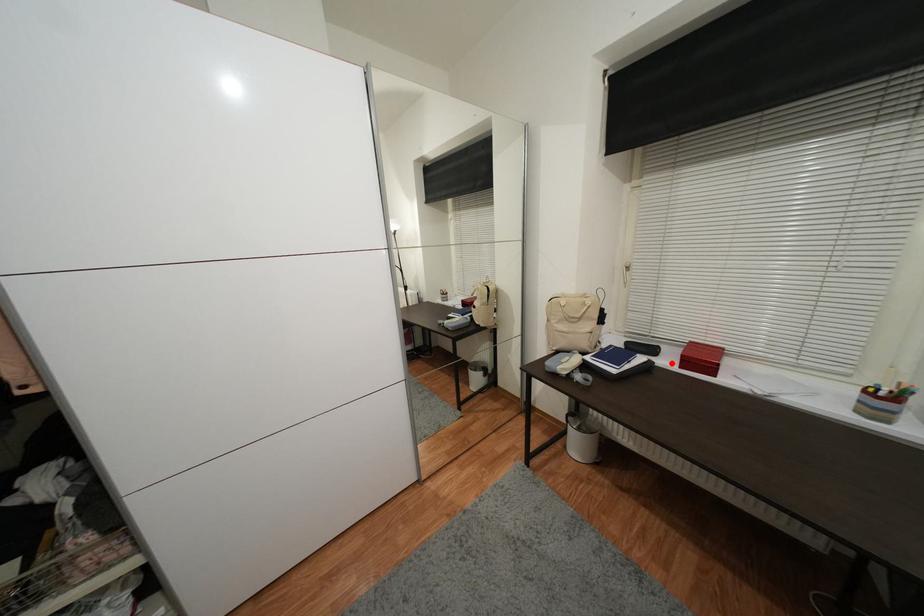
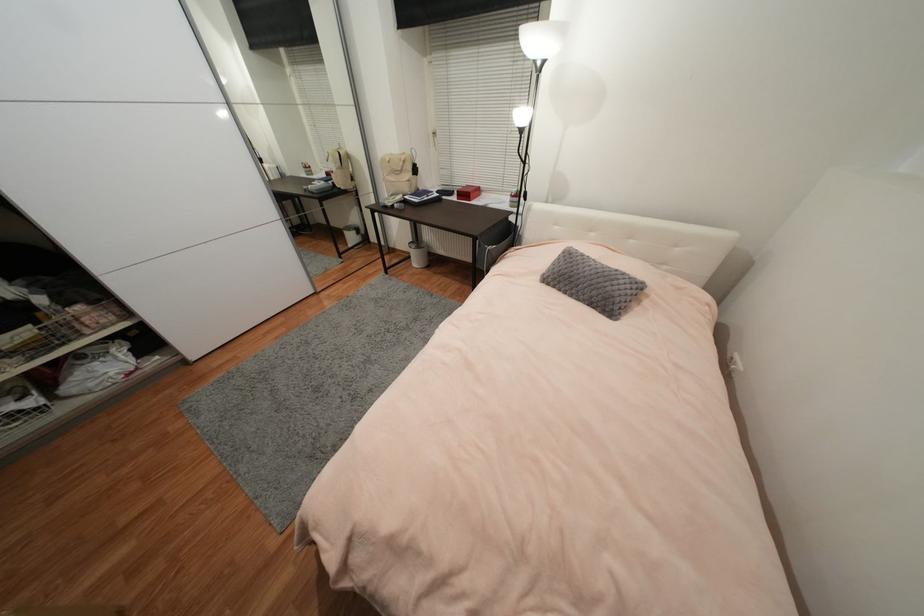
Question: I am providing you with two images of the same scene from different viewpoints. Image1 has a red point marked. In image2, the corresponding 3D location appears at what relative position? Reply with the corresponding letter.

Choices:
 (A) Closer
 (B) Farther

Answer: (A)